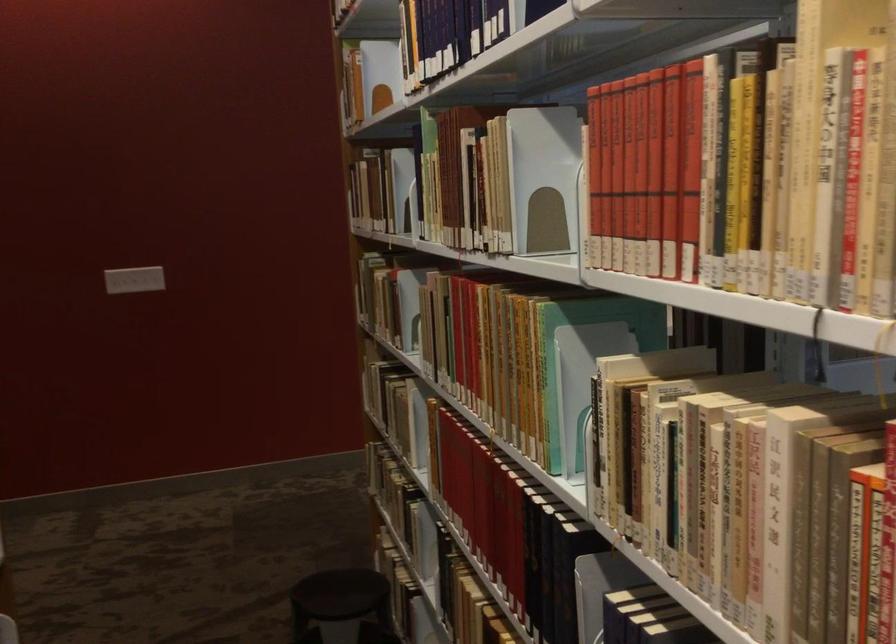
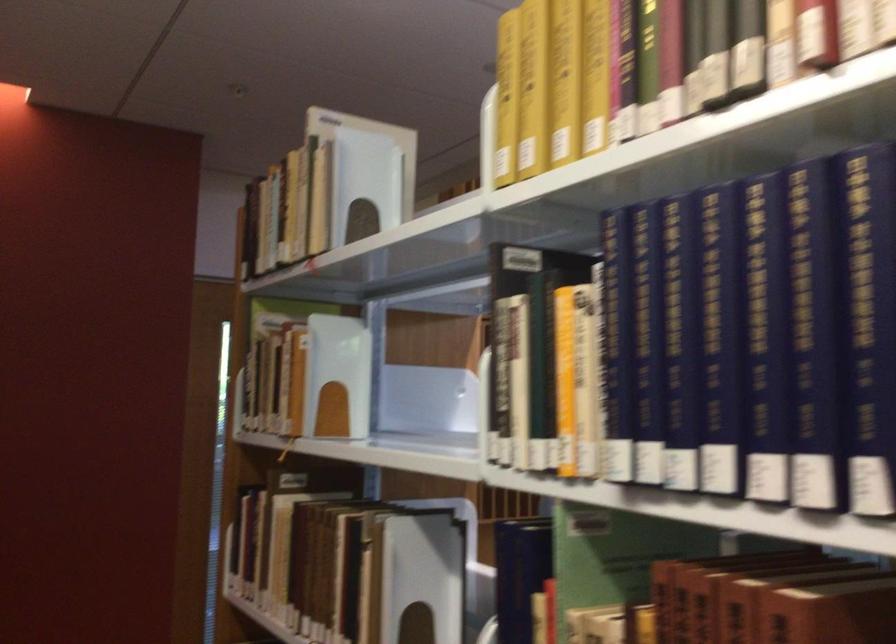
In a continuous first-person perspective shot, in which direction is the camera moving?

The cameraman walked toward left, forward.